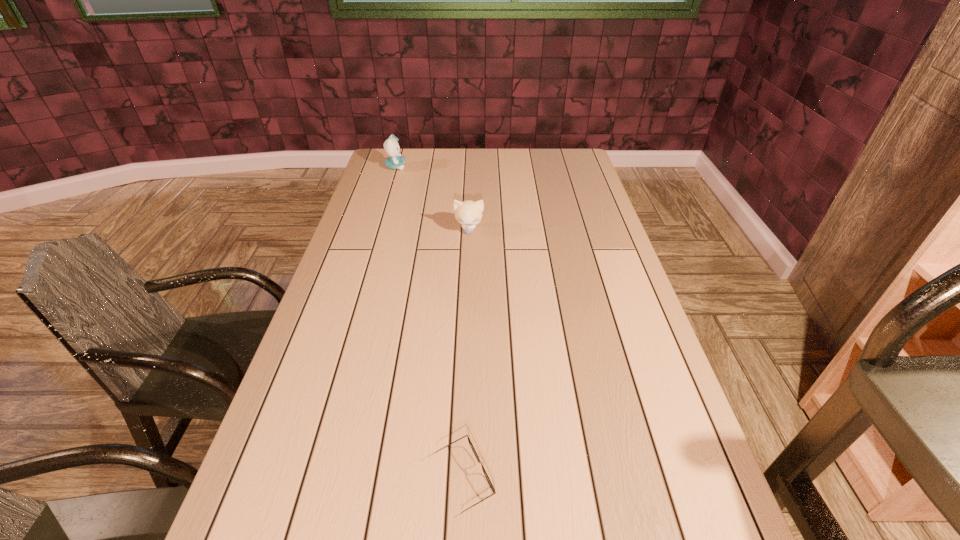
You are a GUI agent. You are given a task and a screenshot of the screen. Output one action in this format:
    pyautogui.click(x=<x>, y=<y>)
    Task: Click on the object that is at the left edge
    
    Given the screenshot: What is the action you would take?
    pyautogui.click(x=391, y=146)

Where is `object that is positioned at the far left corner`? The image size is (960, 540). object that is positioned at the far left corner is located at coordinates 391,146.

The width and height of the screenshot is (960, 540). What are the coordinates of `free space at the far edge` in the screenshot? It's located at (425, 166).

The height and width of the screenshot is (540, 960). Find the location of `vacant space at the left edge`. vacant space at the left edge is located at coordinates (350, 279).

The width and height of the screenshot is (960, 540). I want to click on free point at the right edge, so click(613, 273).

Where is `vacant space at the far right corner of the desktop`? The height and width of the screenshot is (540, 960). vacant space at the far right corner of the desktop is located at coordinates coord(554,175).

The height and width of the screenshot is (540, 960). I want to click on vacant space that's between the nearer kitten and the left kitten, so click(x=432, y=198).

This screenshot has width=960, height=540. Identify the location of empty space that is in between the farthest object and the nearer kitten. (432, 198).

This screenshot has width=960, height=540. Identify the location of free area in between the farthest object and the nearest object. (430, 323).

Where is `free space that is in between the farther kitten and the right kitten`? free space that is in between the farther kitten and the right kitten is located at coordinates (432, 198).